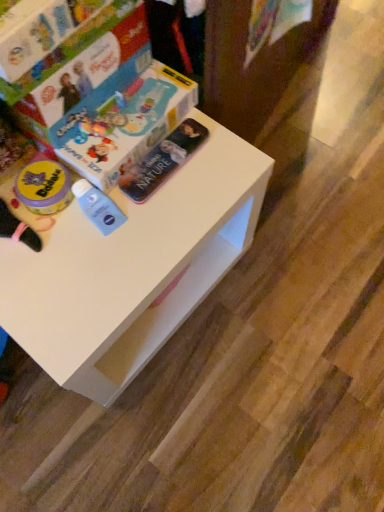
The width and height of the screenshot is (384, 512). Find the location of `vacant space in front of white matte table at center`. vacant space in front of white matte table at center is located at coordinates (147, 432).